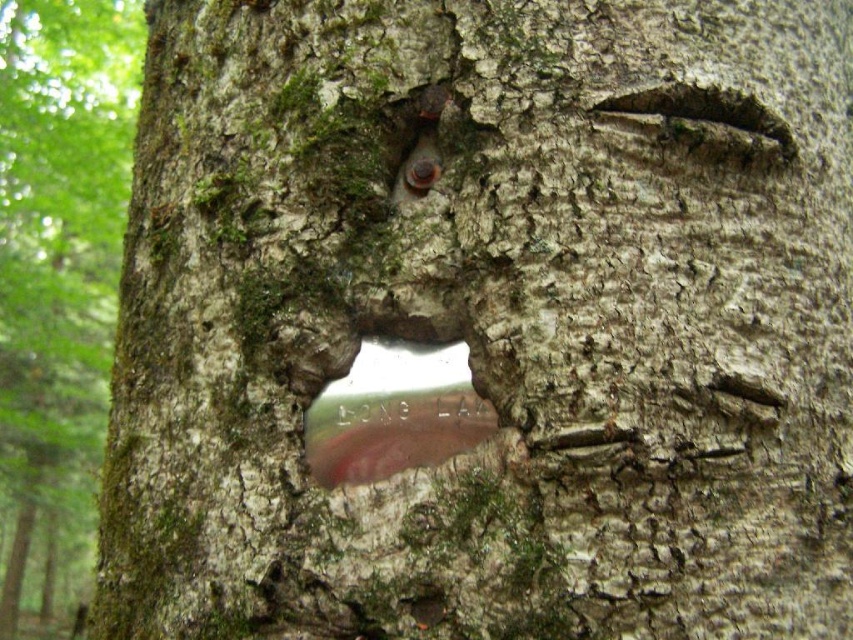
Which is in front, point (21, 68) or point (427, 397)?

Positioned in front is point (427, 397).

Does point (68, 358) lie in front of point (407, 326)?

No, (68, 358) is further to viewer.

Describe the element at coordinates (57, 284) in the screenshot. I see `green mossy bark at left` at that location.

This screenshot has height=640, width=853. What are the coordinates of `green mossy bark at left` in the screenshot? It's located at (57, 284).